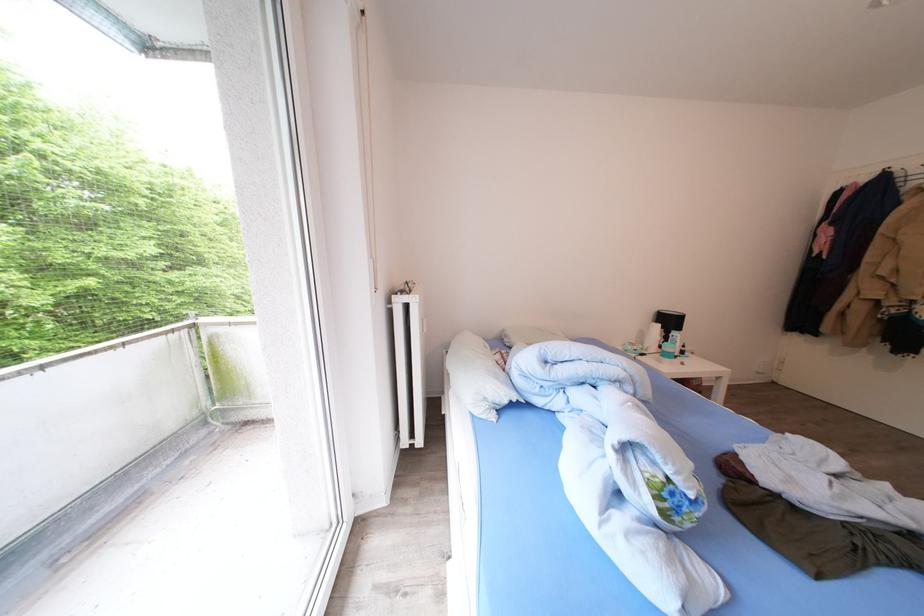
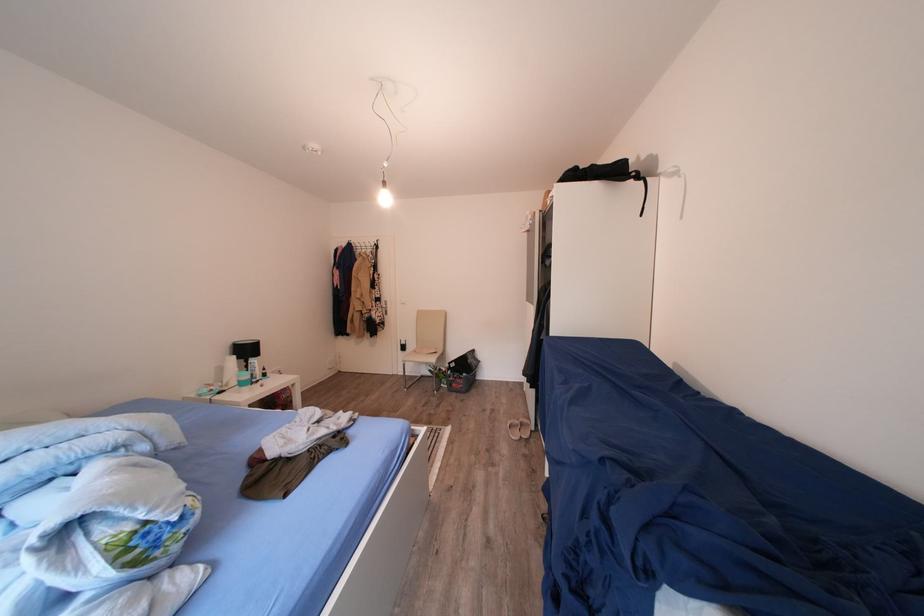
Find the pixel in the second image that matches [673,490] in the first image.

(142, 538)